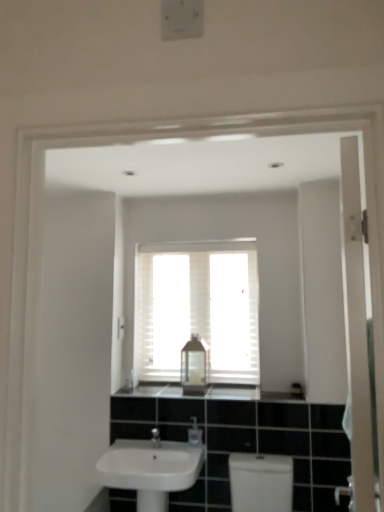
Question: Is white matte window at center at the right side of white plastic light switch at upper center?

Choices:
 (A) no
 (B) yes

Answer: (B)

Question: Could you tell me if white matte window at center is turned towards white plastic light switch at upper center?

Choices:
 (A) yes
 (B) no

Answer: (B)

Question: Is white matte window at center located outside white plastic light switch at upper center?

Choices:
 (A) yes
 (B) no

Answer: (A)

Question: From the image's perspective, does white matte window at center appear lower than white plastic light switch at upper center?

Choices:
 (A) yes
 (B) no

Answer: (B)

Question: Considering the relative sizes of white matte window at center and white plastic light switch at upper center in the image provided, is white matte window at center smaller than white plastic light switch at upper center?

Choices:
 (A) no
 (B) yes

Answer: (A)

Question: In the image, is white glossy door at right positioned in front of or behind white glossy sink at lower center?

Choices:
 (A) front
 (B) behind

Answer: (A)

Question: From a real-world perspective, is white glossy door at right physically located above or below white glossy sink at lower center?

Choices:
 (A) above
 (B) below

Answer: (A)

Question: Is point (342, 233) closer or farther from the camera than point (119, 455)?

Choices:
 (A) closer
 (B) farther

Answer: (A)

Question: Is white glossy door at right inside or outside of white glossy sink at lower center?

Choices:
 (A) inside
 (B) outside

Answer: (B)

Question: Looking at the image, does black granite countertop at center seem bigger or smaller compared to white plastic light switch at upper center?

Choices:
 (A) small
 (B) big

Answer: (B)

Question: In the image, is black granite countertop at center positioned in front of or behind white plastic light switch at upper center?

Choices:
 (A) behind
 (B) front

Answer: (B)

Question: Considering the positions of black granite countertop at center and white plastic light switch at upper center in the image, is black granite countertop at center taller or shorter than white plastic light switch at upper center?

Choices:
 (A) tall
 (B) short

Answer: (B)

Question: Which is correct: black granite countertop at center is inside white plastic light switch at upper center, or outside of it?

Choices:
 (A) outside
 (B) inside

Answer: (A)

Question: In the image, is black granite countertop at center on the left side or the right side of clear plastic soap dispenser at center?

Choices:
 (A) left
 (B) right

Answer: (B)

Question: From the image's perspective, relative to clear plastic soap dispenser at center, is black granite countertop at center above or below?

Choices:
 (A) below
 (B) above

Answer: (B)